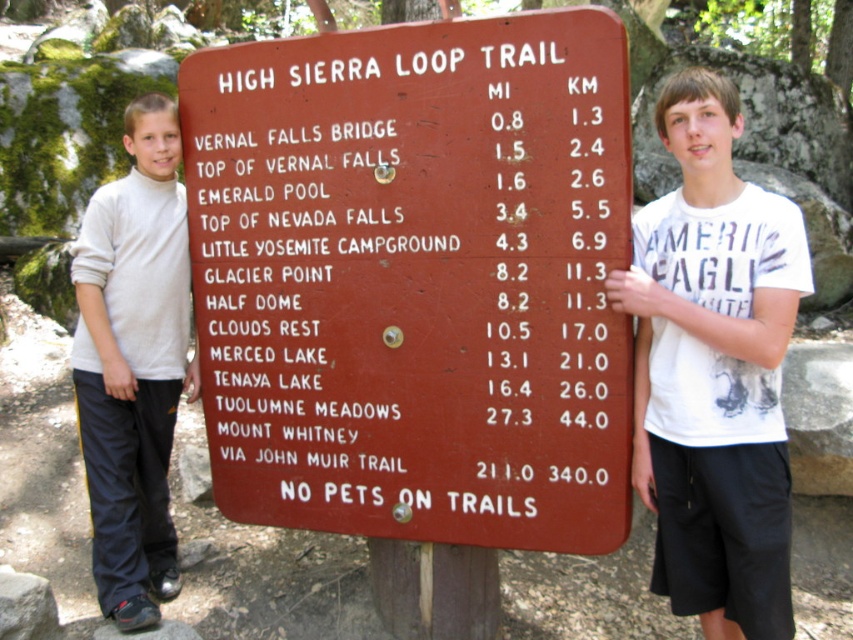
Can you confirm if white cotton t-shirt at center is positioned above white turtleneck sweater at left?

Incorrect, white cotton t-shirt at center is not positioned above white turtleneck sweater at left.

Describe the element at coordinates (712, 369) in the screenshot. The image size is (853, 640). I see `white cotton t-shirt at center` at that location.

Between point (708, 579) and point (119, 532), which one is positioned in front?

Point (708, 579) is in front.

The width and height of the screenshot is (853, 640). Identify the location of white cotton t-shirt at center. (712, 369).

Can you confirm if brown wooden sign at center is positioned above white cotton t-shirt at center?

Yes, brown wooden sign at center is above white cotton t-shirt at center.

Between brown wooden sign at center and white cotton t-shirt at center, which one is positioned higher?

Positioned higher is brown wooden sign at center.

Is point (392, 54) positioned after point (688, 84)?

That is True.

I want to click on brown wooden sign at center, so click(x=416, y=280).

Who is more distant from viewer, (589, 474) or (131, 176)?

Positioned behind is point (131, 176).

Identify the location of brown wooden sign at center. (416, 280).